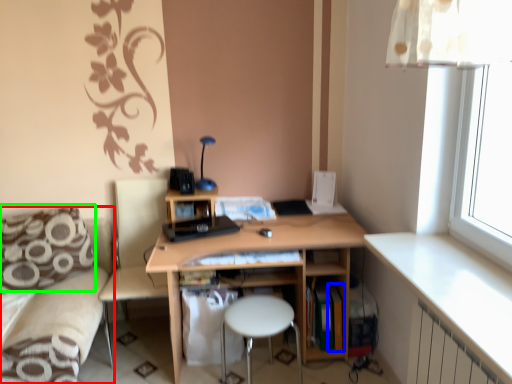
Question: Estimate the real-world distances between objects in this image. Which object is farther from couch (highlighted by a red box), book (highlighted by a blue box) or pillow (highlighted by a green box)?

Choices:
 (A) book
 (B) pillow

Answer: (A)